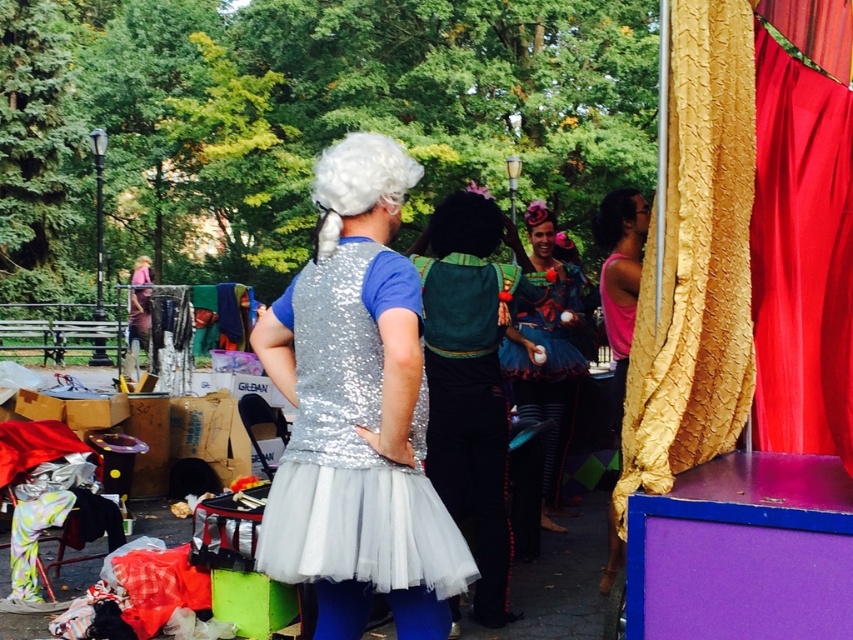
You are standing in the park and see two points in the scene. Which point is closer to you, point 1 at (x=416, y=499) or point 2 at (x=799, y=424)?

Point 1 at (x=416, y=499) is closer to the viewer than point 2 at (x=799, y=424).

In the park scene, there are several people in costumes. The shiny silver dress at center is located at point (x=357, y=412). Where exactly is this point in the image?

The point (x=357, y=412) marks the location of the shiny silver dress at center in the image.

You are a photographer trying to capture a group photo of the shiny silver dress at center and the shiny blue tulle skirt at center. The camera you are using has a maximum focus range of 8 feet. Can you fit both subjects within the camera frame without moving either of them?

The shiny silver dress at center and shiny blue tulle skirt at center are 8.88 feet apart from each other, which exceeds the camera maximum focus range of 8 feet. Therefore, you cannot fit both subjects within the camera frame without moving them.